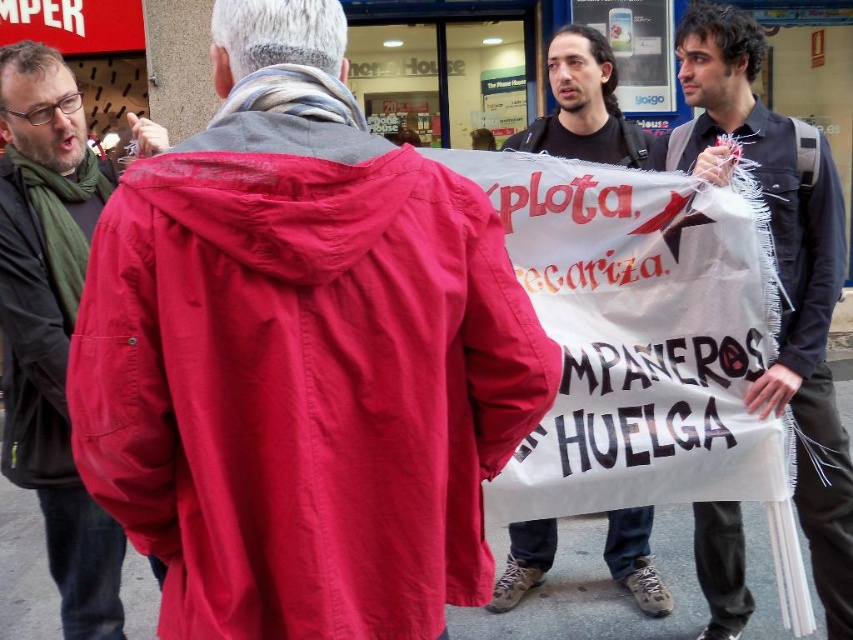
You are a photographer trying to capture a closeup of the matte red jacket at left and the matte black jacket at left in the same frame. Given that your camera has a focal length of 50mm and a sensor size of 24x36mm, what is the minimum distance you need to stand from the jackets to ensure both are in focus?

The minimum distance required is calculated using the hyperfocal distance formula, but since the jackets are only 2.35 inches apart, you can focus on the midpoint between them. At 50mm focal length and typical aperture settings, standing approximately 10 feet away should keep both jackets in acceptable focus.

You are a photographer standing at the edge of the protest. You want to capture a photo that includes both the denim jacket at center and the matte red jacket at left. What is the minimum distance you need to move backward to ensure both are in frame?

The denim jacket at center is 1.65 meters away from the matte red jacket at left. To include both in the frame, you need to move back at least 1.65 meters so that the camera can capture the entire distance between them.

You are a photographer trying to capture a clear shot of both the matte red jacket at left and the matte black jacket at left. Since you can only focus on one subject at a time, which jacket should you focus on first to ensure the other remains in the background?

The matte red jacket at left is located below the matte black jacket at left. Therefore, focusing on the matte black jacket at left first will keep the matte red jacket at left in the background.